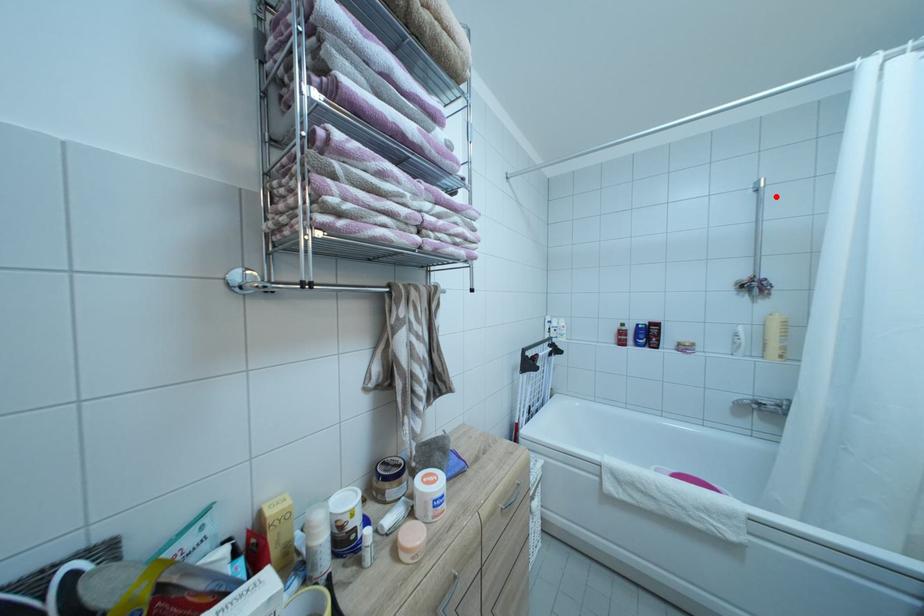
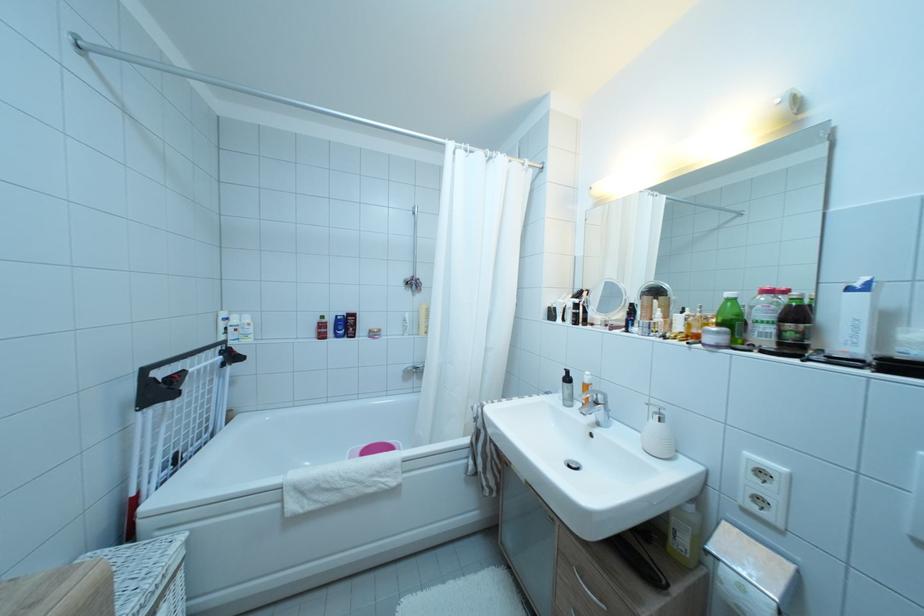
The point at the highlighted location is marked in the first image. Where is the corresponding point in the second image?

(428, 222)